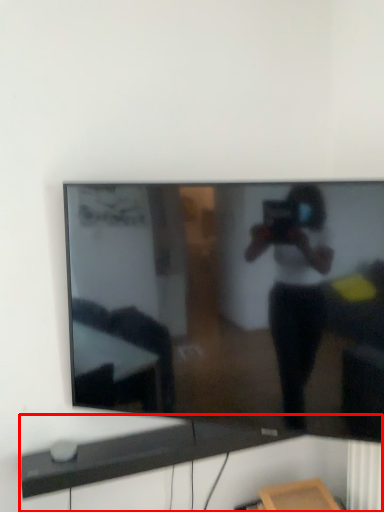
Question: From the image's perspective, where is computer desk (annotated by the red box) located relative to television?

Choices:
 (A) below
 (B) above

Answer: (A)